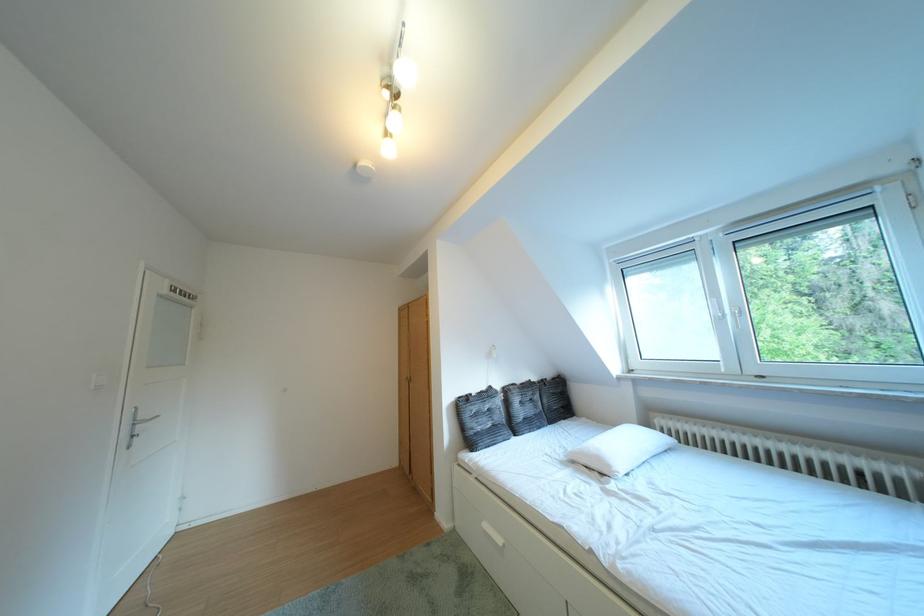
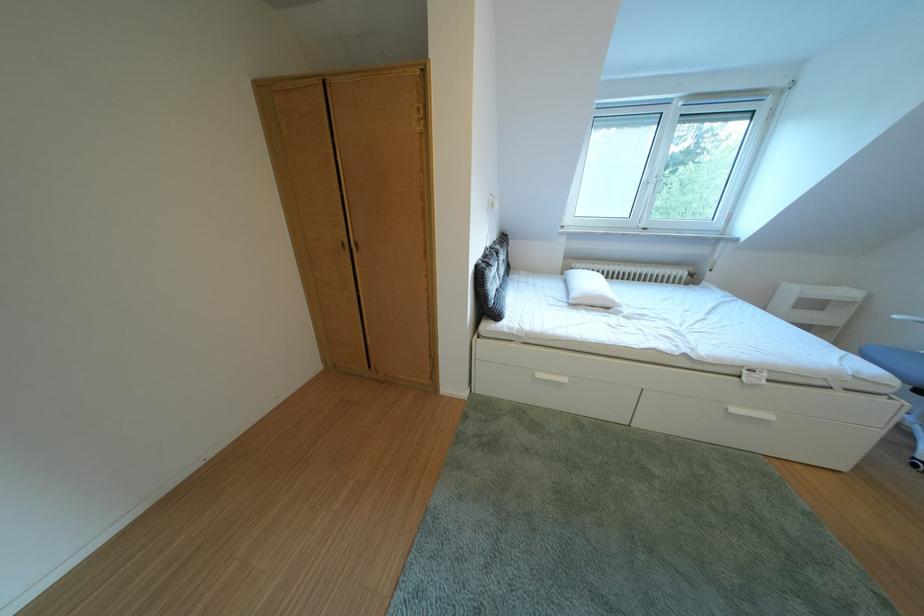
Find the pixel in the second image that matches point (517, 392) in the first image.

(505, 254)